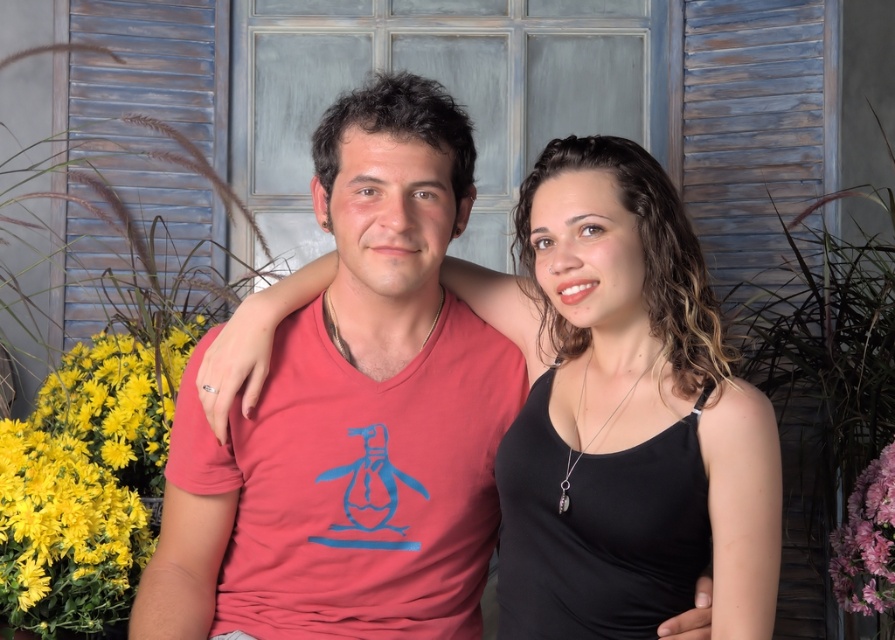
You are standing in a room with a window that has wooden shutters. You see a point labeled as point (152,112). Based on the scene description, where is this point located?

The point (152,112) marks the metallic blue shutter at upper left.

You are standing at the camera position and want to pick up the yellow matte flower at left. Can you reach it without moving your feet? The average arm length is 2.5 feet.

The yellow matte flower at left is 6.05 feet away from the camera, which is farther than the average arm length of 2.5 feet. You cannot reach it without moving your feet.

You are an AI analyzing the spatial coordinates of clothing items in a photo. The scene shows two people standing near a window with wooden shutters. You need to determine the exact position of the black matte tank top at center. What are its coordinates?

The black matte tank top at center is located at coordinates point (x=637, y=348).